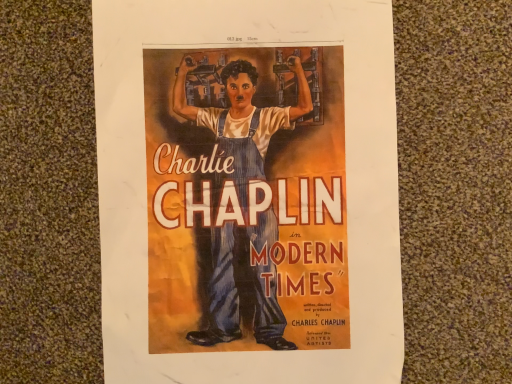
I want to click on matte blue overalls at center, so click(248, 191).

What is the approximate width of matte blue overalls at center?

12.28 inches.

Describe the element at coordinates (248, 191) in the screenshot. The image size is (512, 384). I see `matte blue overalls at center` at that location.

Where is `matte blue overalls at center`? matte blue overalls at center is located at coordinates (248, 191).